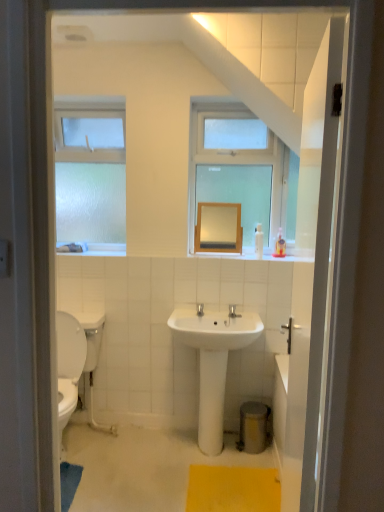
Question: Is smooth wooden mirror at center taller or shorter than frosted glass window at left?

Choices:
 (A) tall
 (B) short

Answer: (B)

Question: Is smooth wooden mirror at center spatially inside frosted glass window at left, or outside of it?

Choices:
 (A) inside
 (B) outside

Answer: (B)

Question: Which object is positioned closest to the white glossy sink at center?

Choices:
 (A) smooth wooden mirror at center
 (B) frosted glass window at left
 (C) yellow textured bath mat at lower center

Answer: (C)

Question: Which of these objects is positioned farthest from the yellow textured bath mat at lower center?

Choices:
 (A) frosted glass window at left
 (B) smooth wooden mirror at center
 (C) white glossy sink at center

Answer: (A)